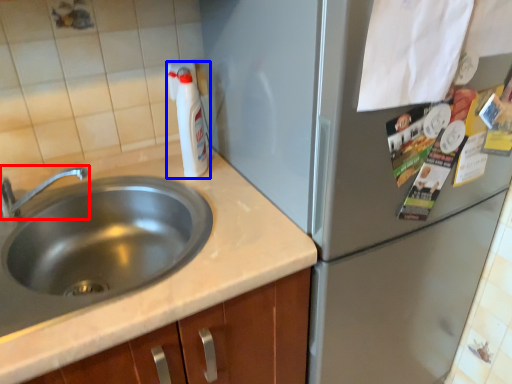
Question: Which of the following is the farthest to the observer, tap (highlighted by a red box) or bottle (highlighted by a blue box)?

Choices:
 (A) tap
 (B) bottle

Answer: (B)